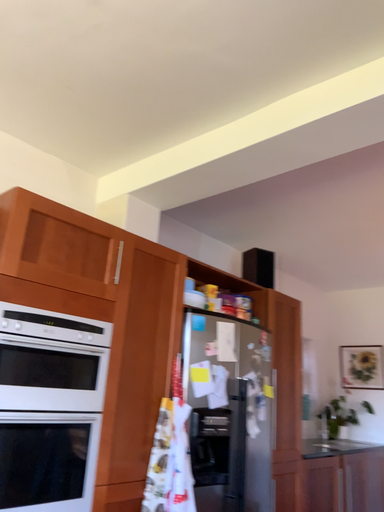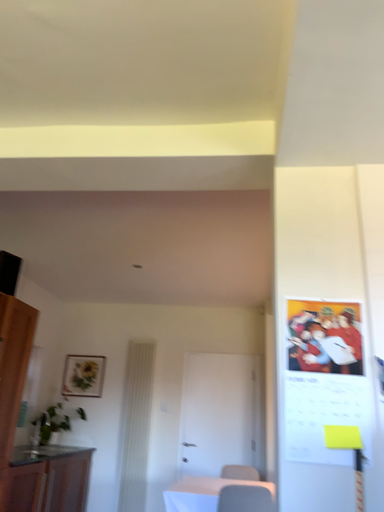
Question: How did the camera likely rotate when shooting the video?

Choices:
 (A) rotated left
 (B) rotated right

Answer: (B)